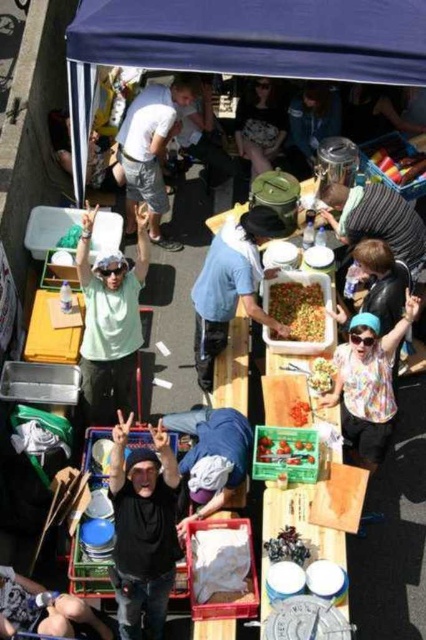
Between black matte shirt at center and striped fabric shirt at upper center, which one has more height?

black matte shirt at center

Is black matte shirt at center taller than striped fabric shirt at upper center?

Correct, black matte shirt at center is much taller as striped fabric shirt at upper center.

Between point (132, 470) and point (409, 209), which one is positioned behind?

Positioned behind is point (409, 209).

Identify the location of black matte shirt at center. This screenshot has height=640, width=426. (143, 529).

Is blue fabric canopy at upper center thinner than smooth red strawberries at center?

No, blue fabric canopy at upper center is not thinner than smooth red strawberries at center.

Which is in front, point (250, 65) or point (305, 401)?

Positioned in front is point (305, 401).

Where is `blue fabric canopy at upper center`? This screenshot has height=640, width=426. blue fabric canopy at upper center is located at coordinates 241,44.

Does blue denim jacket at center have a smaller size compared to smooth plastic container at center?

No.

Does point (204, 440) come farther from viewer compared to point (270, 449)?

That is True.

This screenshot has height=640, width=426. What do you see at coordinates (212, 456) in the screenshot?
I see `blue denim jacket at center` at bounding box center [212, 456].

You are a GUI agent. You are given a task and a screenshot of the screen. Output one action in this format:
    pyautogui.click(x=<x>, y=<y>)
    Task: Click on the blue denim jacket at center
    The width and height of the screenshot is (426, 640).
    Given the screenshot: What is the action you would take?
    pyautogui.click(x=212, y=456)